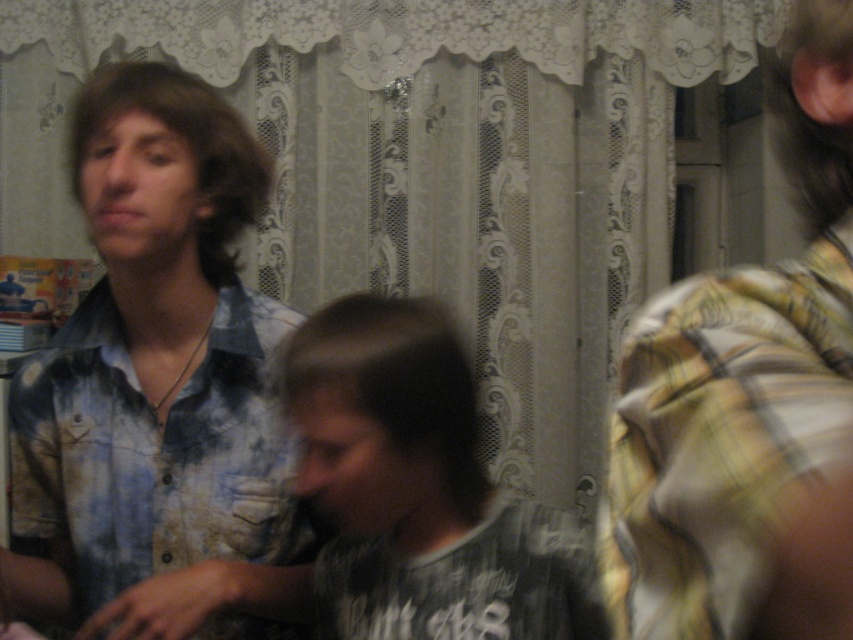
Question: Does blue tie-dye shirt at left appear over yellow plaid shirt at right?

Choices:
 (A) no
 (B) yes

Answer: (A)

Question: Which point is farther to the camera?

Choices:
 (A) dark gray t-shirt at center
 (B) blue tie-dye shirt at left
 (C) yellow plaid shirt at right

Answer: (B)

Question: Which of the following is the farthest from the observer?

Choices:
 (A) blue tie-dye shirt at left
 (B) yellow plaid shirt at right
 (C) dark gray t-shirt at center

Answer: (A)

Question: Can you confirm if blue tie-dye shirt at left is wider than dark gray t-shirt at center?

Choices:
 (A) no
 (B) yes

Answer: (A)

Question: Can you confirm if blue tie-dye shirt at left is positioned to the left of yellow plaid shirt at right?

Choices:
 (A) yes
 (B) no

Answer: (A)

Question: Which object appears closest to the camera in this image?

Choices:
 (A) yellow plaid shirt at right
 (B) blue tie-dye shirt at left

Answer: (A)